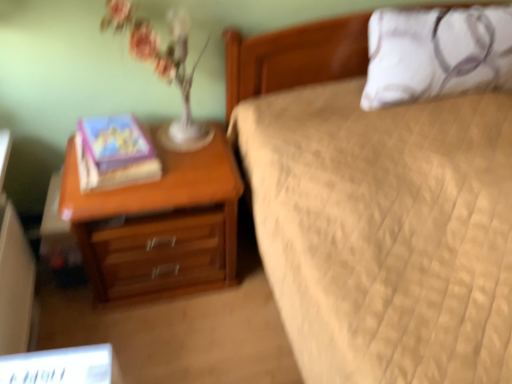
Find the location of `free point below translucent glass vase at upper left (from a real-world perspective)`. free point below translucent glass vase at upper left (from a real-world perspective) is located at coordinates (178, 131).